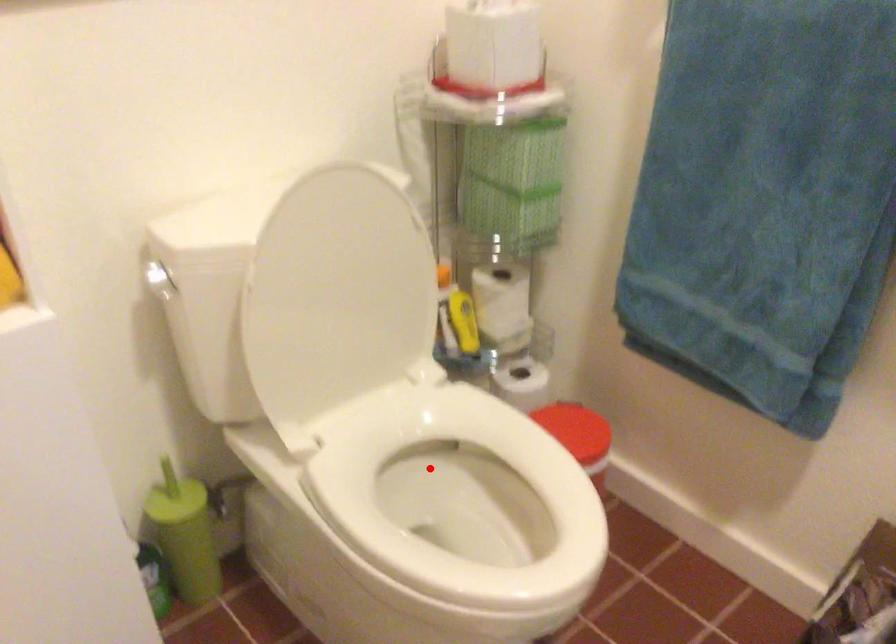
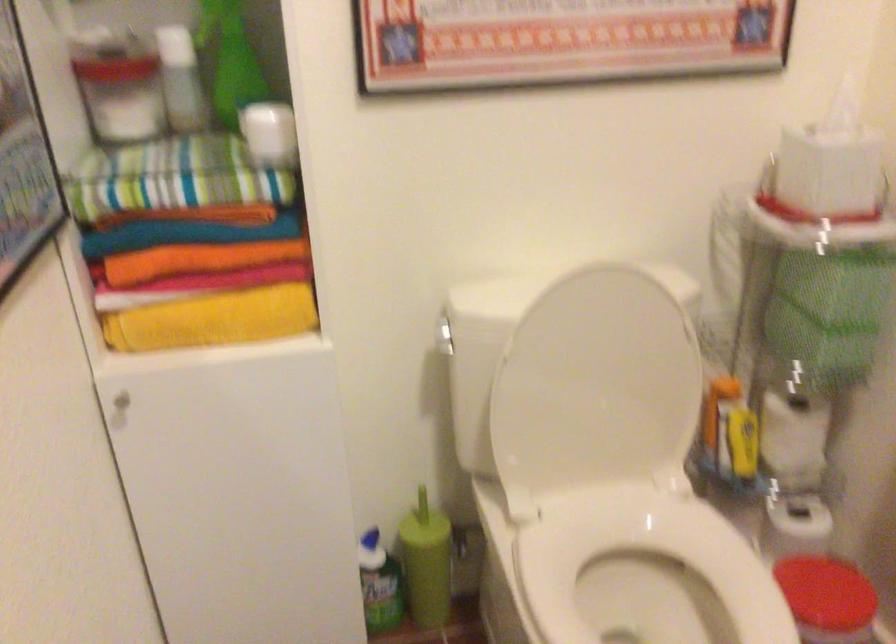
Find the pixel in the second image that matches the highlighted location in the first image.

(648, 578)